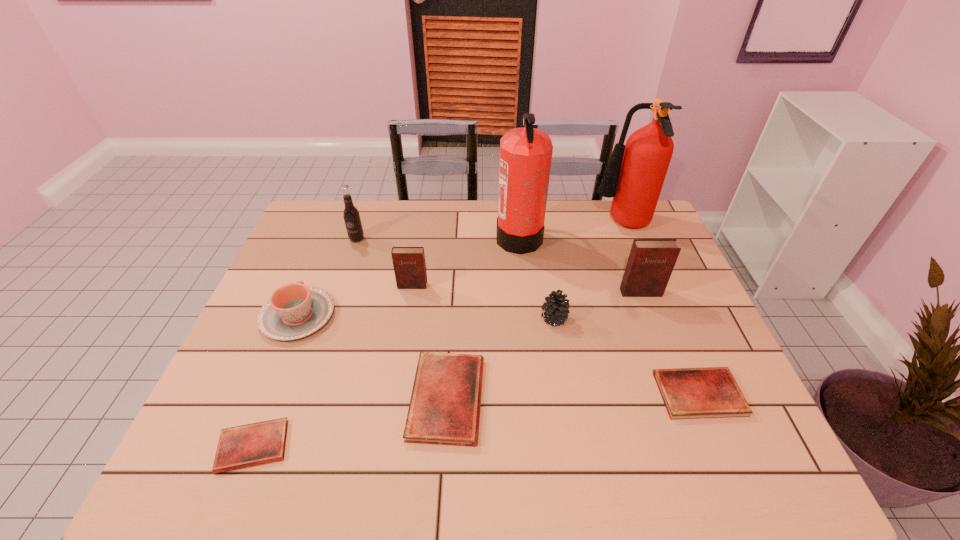
This screenshot has height=540, width=960. Identify the location of vacant space that's between the fifth tallest object and the leftmost diary. (332, 366).

Locate an element on the screen. vacant area that lies between the black fire extinguisher and the biggest red diary is located at coordinates (483, 318).

The width and height of the screenshot is (960, 540). I want to click on blank region between the pink chinaware and the bigger reddish-brown diary, so click(x=469, y=304).

You are a GUI agent. You are given a task and a screenshot of the screen. Output one action in this format:
    pyautogui.click(x=<x>, y=<y>)
    Task: Click on the free space between the second tallest diary and the second shortest diary
    This screenshot has height=540, width=960.
    Given the screenshot: What is the action you would take?
    pyautogui.click(x=556, y=340)

The image size is (960, 540). I want to click on vacant area between the black fire extinguisher and the second shortest diary, so click(x=609, y=315).

Where is `object that is the seventh closest one to the red fire extinguisher`? This screenshot has width=960, height=540. object that is the seventh closest one to the red fire extinguisher is located at coordinates (352, 220).

Point out which object is positioned as the ninth nearest to the second shortest diary. Please provide its 2D coordinates. Your answer should be formatted as a tuple, i.e. [(x, y)], where the tuple contains the x and y coordinates of a point satisfying the conditions above.

[(352, 220)]

This screenshot has width=960, height=540. What are the coordinates of `the closest diary to the fourth shortest object` in the screenshot? It's located at (409, 265).

This screenshot has height=540, width=960. In order to click on diary identified as the second closest to the left fire extinguisher in this screenshot , I will do pos(650,264).

You are a GUI agent. You are given a task and a screenshot of the screen. Output one action in this format:
    pyautogui.click(x=<x>, y=<y>)
    Task: Click on the red diary that is the closest to the second red diary from left to right
    
    Given the screenshot: What is the action you would take?
    pyautogui.click(x=259, y=443)